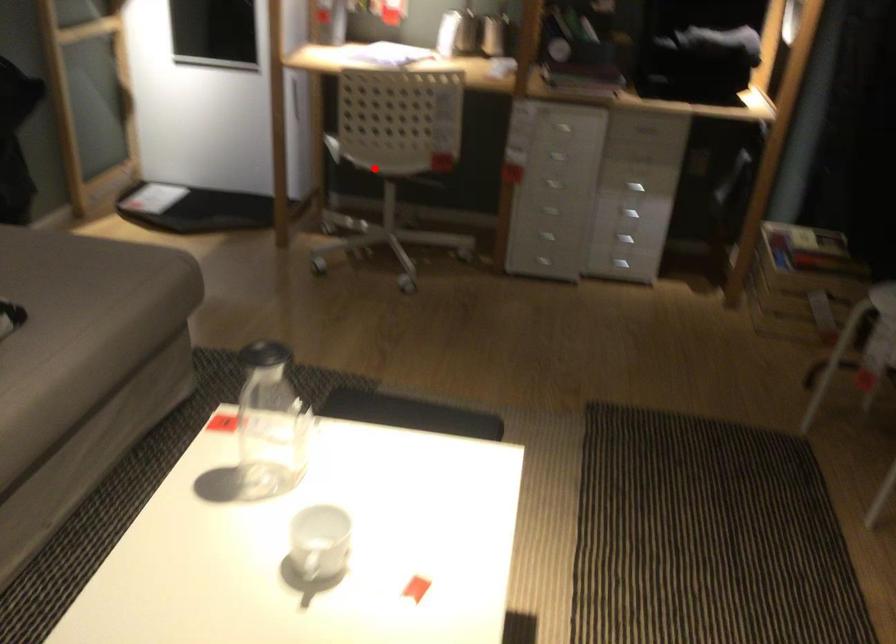
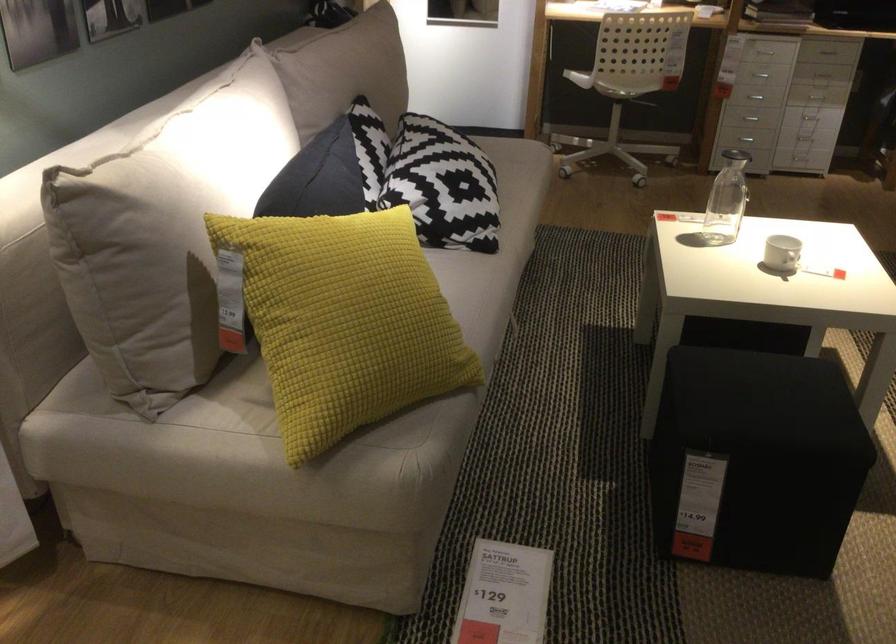
Question: I am providing you with two images of the same scene from different viewpoints. Image1 has a red point marked. In image2, the corresponding 3D location appears at what relative position? Reply with the corresponding letter.

Choices:
 (A) Closer
 (B) Farther

Answer: (B)